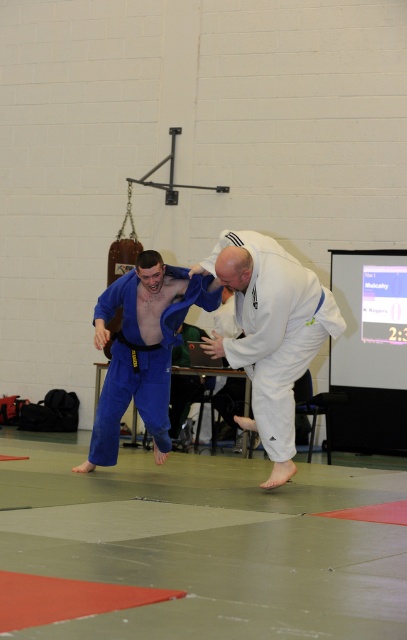
You are a judo referee observing the match between the white matte kimono at center and the blue fabric at center. Which competitor is using a larger area of their uniform visible in the current position?

The blue fabric at center occupies more space than the white matte kimono at center, so the competitor in the blue fabric at center has a larger visible area of their uniform.

You are a referee observing a judo match and need to determine which competitor is in control. Based on their positions, which competitor is closer to you, the white matte kimono at center or the blue fabric at center?

The white matte kimono at center is closer to the viewer than the blue fabric at center, indicating that the competitor in white is in a more dominant position and likely has control during this moment of the match.